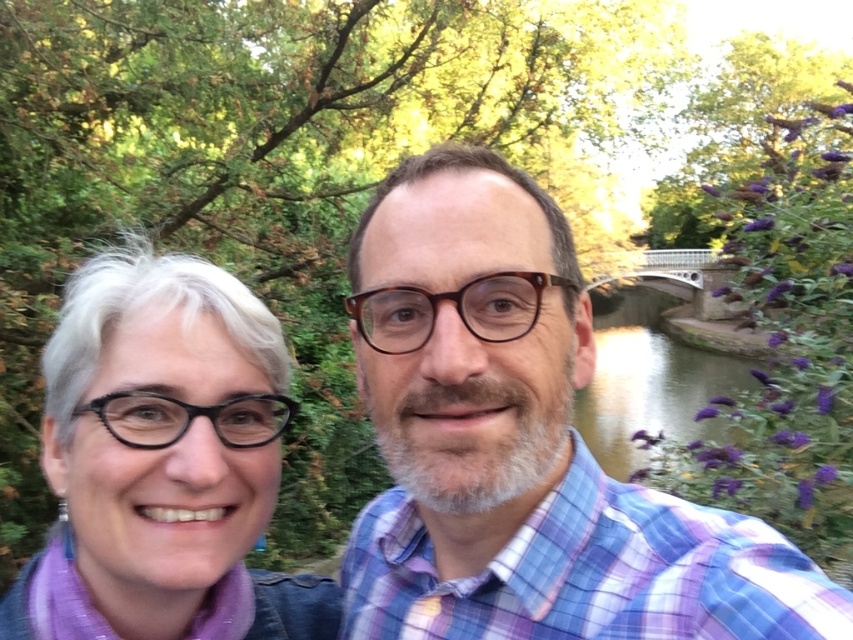
You are trying to decide which object is higher in the image. You see the blue plaid shirt at center and the matte black glasses at left. Based on their positions, which one is higher?

The blue plaid shirt at center is located above matte black glasses at left, so the blue plaid shirt at center is higher.

You are a photographer trying to capture a photo of the blue plaid shirt at center and the matte black glasses at left. Based on their positions, which object should you focus on first if you want to ensure both are in the frame?

The blue plaid shirt at center is to the right of matte black glasses at left, so you should focus on the matte black glasses at left first to ensure both are in the frame.